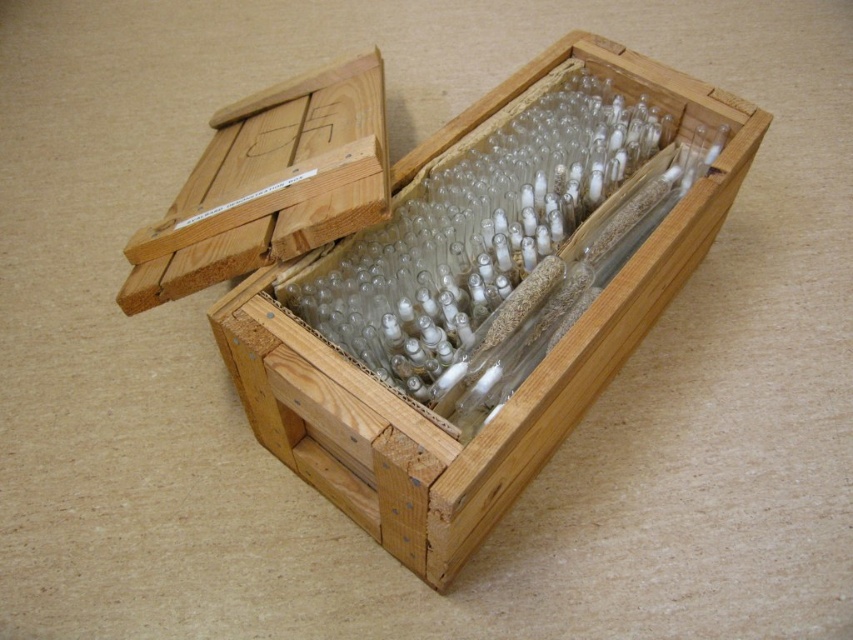
Question: Which point appears closest to the camera in this image?

Choices:
 (A) (247, 243)
 (B) (535, 452)

Answer: (A)

Question: Which object is closer to the camera taking this photo?

Choices:
 (A) natural wood box at center
 (B) natural wood box at upper left

Answer: (A)

Question: Considering the relative positions of natural wood box at center and natural wood box at upper left in the image provided, where is natural wood box at center located with respect to natural wood box at upper left?

Choices:
 (A) above
 (B) below

Answer: (B)

Question: Among these points, which one is nearest to the camera?

Choices:
 (A) click(289, 179)
 (B) click(494, 100)

Answer: (A)

Question: Does natural wood box at center come behind natural wood box at upper left?

Choices:
 (A) yes
 (B) no

Answer: (B)

Question: Does natural wood box at center have a lesser width compared to natural wood box at upper left?

Choices:
 (A) no
 (B) yes

Answer: (A)